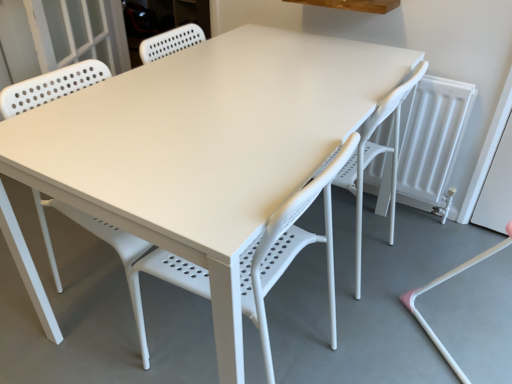
Question: From the image's perspective, is white plastic chair at center over white plastic swivel chair at lower right?

Choices:
 (A) yes
 (B) no

Answer: (B)

Question: Can you confirm if white plastic chair at center is taller than white plastic swivel chair at lower right?

Choices:
 (A) yes
 (B) no

Answer: (B)

Question: Is white plastic swivel chair at lower right inside white plastic chair at center?

Choices:
 (A) yes
 (B) no

Answer: (B)

Question: Is white plastic chair at center wider than white plastic swivel chair at lower right?

Choices:
 (A) yes
 (B) no

Answer: (B)

Question: Considering the relative sizes of white plastic chair at center and white plastic swivel chair at lower right in the image provided, is white plastic chair at center smaller than white plastic swivel chair at lower right?

Choices:
 (A) yes
 (B) no

Answer: (A)

Question: Is the depth of white plastic chair at center greater than that of white plastic swivel chair at lower right?

Choices:
 (A) no
 (B) yes

Answer: (A)

Question: Are white plastic swivel chair at lower right and white plastic chair at center beside each other?

Choices:
 (A) yes
 (B) no

Answer: (B)

Question: Is white plastic swivel chair at lower right bigger than white plastic chair at center?

Choices:
 (A) yes
 (B) no

Answer: (A)

Question: Does white plastic swivel chair at lower right lie behind white plastic chair at center?

Choices:
 (A) yes
 (B) no

Answer: (A)

Question: Would you consider white plastic swivel chair at lower right to be distant from white plastic chair at center?

Choices:
 (A) yes
 (B) no

Answer: (B)

Question: Is white plastic swivel chair at lower right not within white plastic chair at center?

Choices:
 (A) yes
 (B) no

Answer: (A)

Question: Is white plastic chair at center at the back of white plastic swivel chair at lower right?

Choices:
 (A) yes
 (B) no

Answer: (B)

Question: Is white plastic chair at center taller or shorter than white plastic swivel chair at lower right?

Choices:
 (A) short
 (B) tall

Answer: (A)